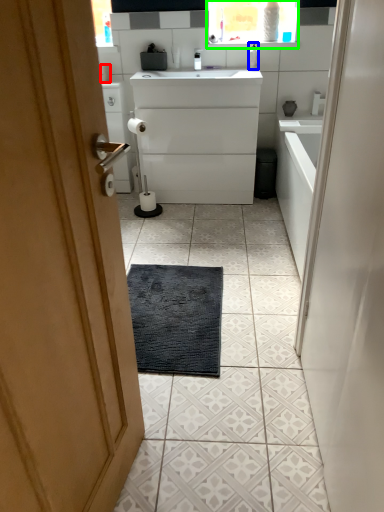
Question: Which object is the closest to the toilet paper (highlighted by a red box)? Choose among these: toiletry (highlighted by a blue box) or medicine cabinet (highlighted by a green box).

Choices:
 (A) toiletry
 (B) medicine cabinet

Answer: (A)